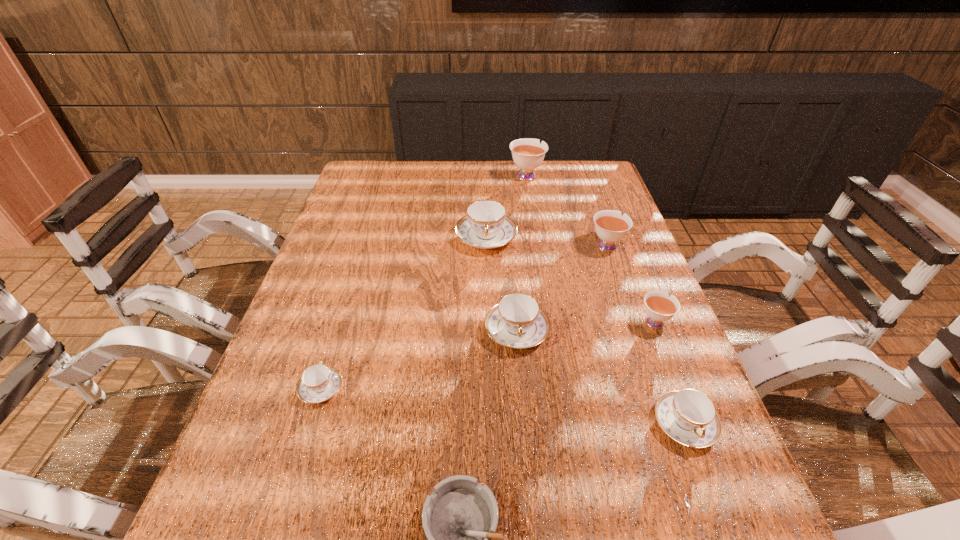
Locate an element on the screen. The image size is (960, 540). the second closest blue teacup to the second smallest blue teacup is located at coordinates (486, 225).

Choose which blue teacup is the third nearest neighbor to the rightmost blue teacup. Please provide its 2D coordinates. Your answer should be formatted as a tuple, i.e. [(x, y)], where the tuple contains the x and y coordinates of a point satisfying the conditions above.

[(319, 382)]